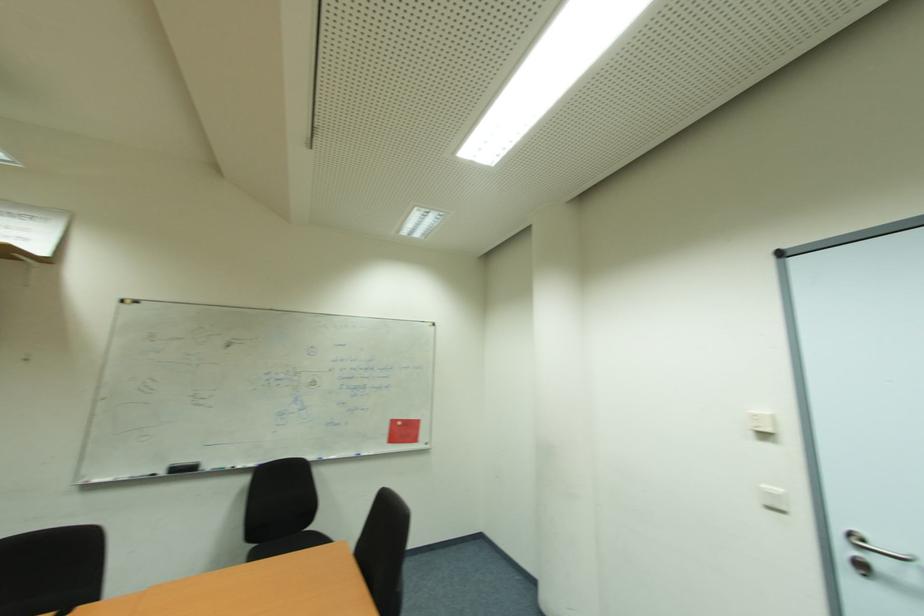
I want to click on white power outlet, so (x=761, y=422).